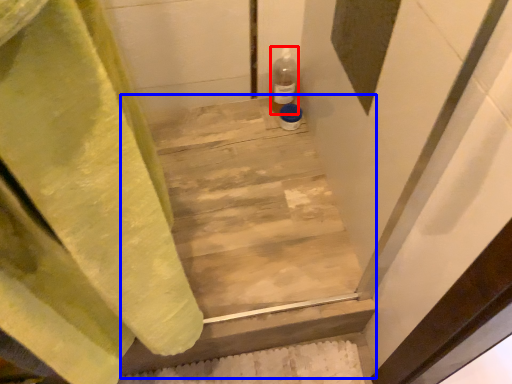
Question: Which of the following is the farthest to the observer, bottle (highlighted by a red box) or stairwell (highlighted by a blue box)?

Choices:
 (A) bottle
 (B) stairwell

Answer: (A)